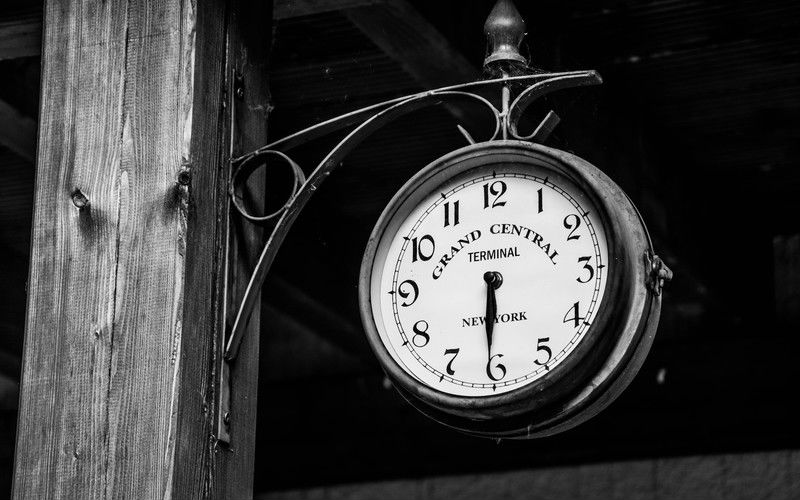
Find the location of a particular element. hanging clock is located at coordinates (630, 214).